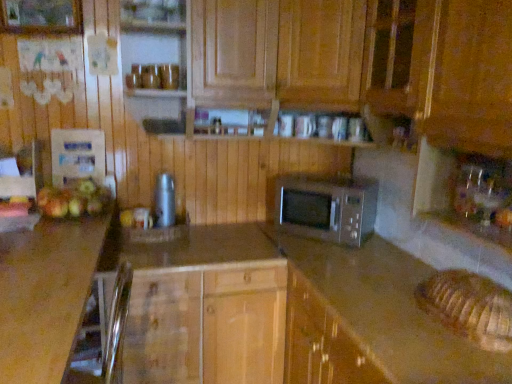
Where is `vacant area that lies in front of green matte apple at left, the 1th apple positioned from the back`? This screenshot has width=512, height=384. vacant area that lies in front of green matte apple at left, the 1th apple positioned from the back is located at coordinates (121, 239).